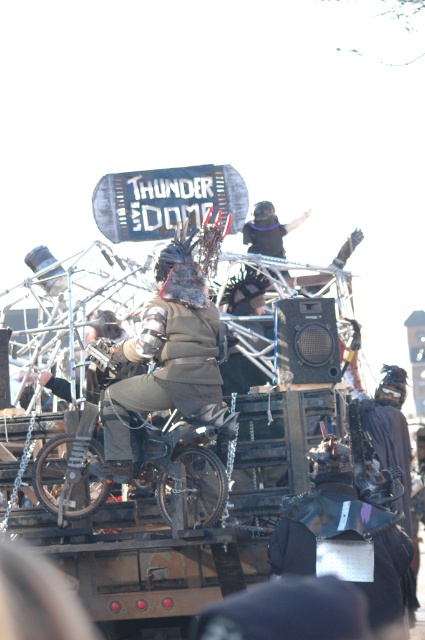
Question: Can you confirm if metallic silver helmet at center is thinner than black matte helmet at upper center?

Choices:
 (A) no
 (B) yes

Answer: (A)

Question: Is dark brown leather jacket at center below black matte helmet at upper center?

Choices:
 (A) yes
 (B) no

Answer: (A)

Question: Which object is positioned farthest from the dark brown leather jacket at center?

Choices:
 (A) metallic silver helmet at center
 (B) black matte helmet at upper center

Answer: (B)

Question: Considering the real-world distances, which object is closest to the black matte helmet at upper center?

Choices:
 (A) metallic silver helmet at center
 (B) dark brown leather jacket at center

Answer: (B)

Question: Which object is positioned farthest from the dark brown leather jacket at center?

Choices:
 (A) metallic silver helmet at center
 (B) black matte helmet at upper center

Answer: (B)

Question: Is the position of dark brown leather jacket at center less distant than that of black matte helmet at upper center?

Choices:
 (A) no
 (B) yes

Answer: (B)